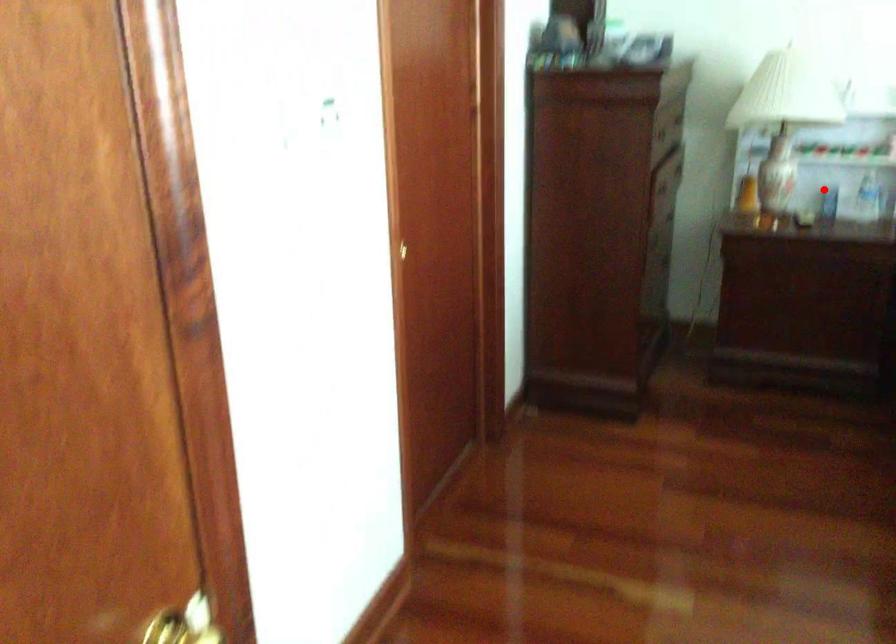
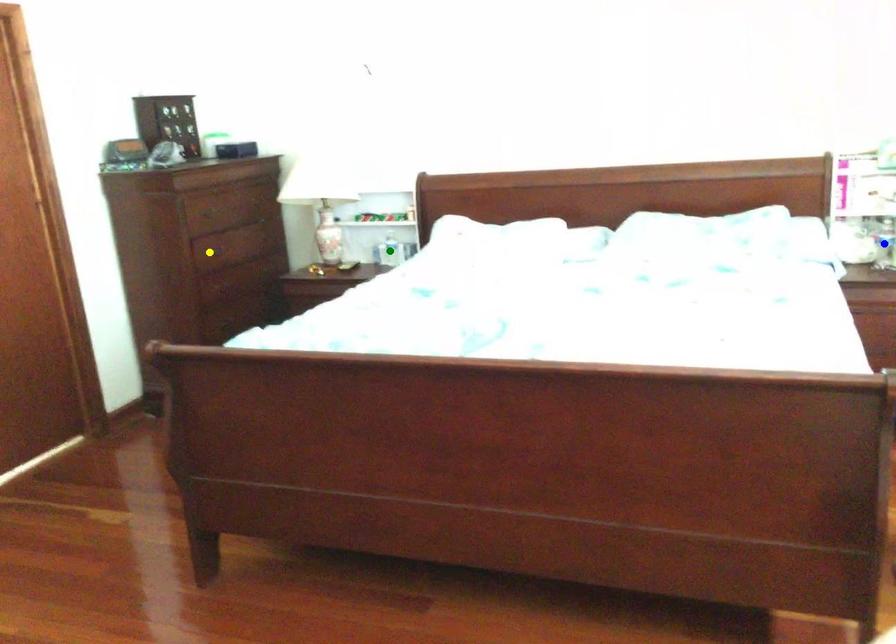
Question: I am providing you with two images of the same scene from different viewpoints. A red point is marked on the first image. You are given multiple points on the second image. Which point in image 2 represents the same 3d spot as the red point in image 1?

Choices:
 (A) blue point
 (B) yellow point
 (C) green point

Answer: (C)